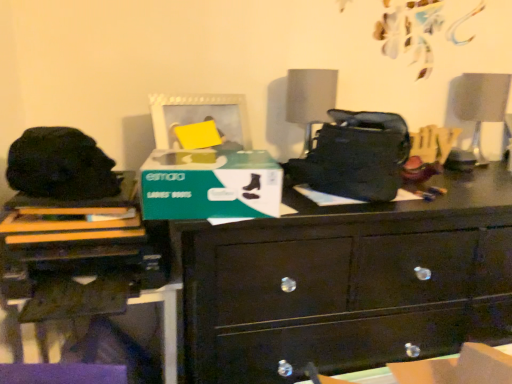
Question: From the image's perspective, is white glossy swivel chair at upper right positioned above or below white matte picture frame at upper center?

Choices:
 (A) below
 (B) above

Answer: (B)

Question: Considering the positions of white glossy swivel chair at upper right and white matte picture frame at upper center in the image, is white glossy swivel chair at upper right wider or thinner than white matte picture frame at upper center?

Choices:
 (A) wide
 (B) thin

Answer: (A)

Question: Estimate the real-world distances between objects in this image. Which object is farther from the green matte cardboard box at center?

Choices:
 (A) white matte picture frame at upper center
 (B) matte black printer at lower left
 (C) white glossy swivel chair at upper right
 (D) matte gray lampshade at center
 (E) black wood chest of drawers at center

Answer: (C)

Question: Considering the real-world distances, which object is farthest from the green matte cardboard box at center?

Choices:
 (A) matte gray lampshade at center
 (B) white glossy swivel chair at upper right
 (C) black wood chest of drawers at center
 (D) white matte picture frame at upper center
 (E) glossy dark wood drawer at lower center

Answer: (B)